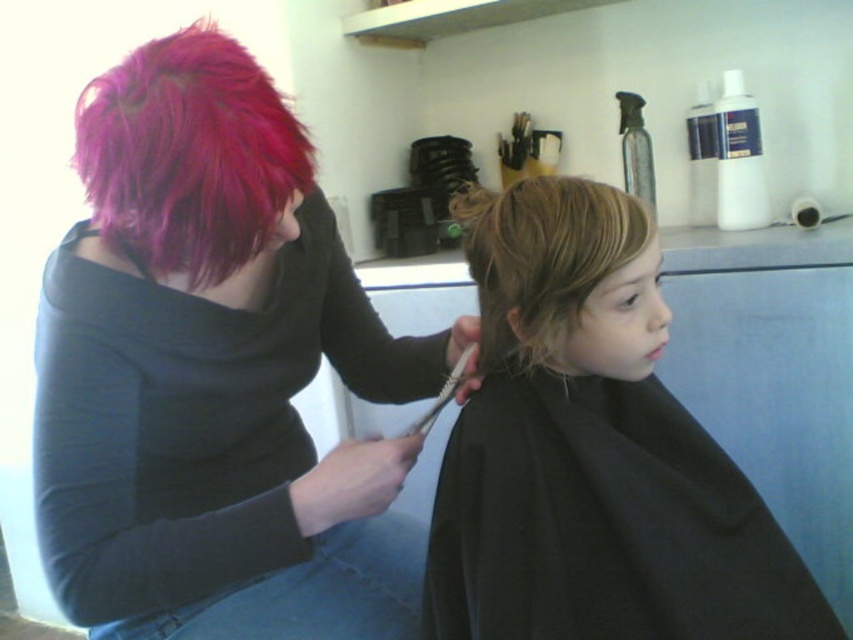
Between shiny pink hair at upper left and blonde hair at center, which one appears on the left side from the viewer's perspective?

From the viewer's perspective, shiny pink hair at upper left appears more on the left side.

Who is more distant from viewer, [108,240] or [434,525]?

Positioned behind is point [108,240].

The width and height of the screenshot is (853, 640). Identify the location of shiny pink hair at upper left. (213, 372).

Is point (341, 550) positioned after point (538, 257)?

That is True.

Between shiny pink hair at upper left and light brown silky hair at center, which one is positioned lower?

shiny pink hair at upper left is below.

Where is `shiny pink hair at upper left`? shiny pink hair at upper left is located at coordinates (213, 372).

Find the location of a particular element. The height and width of the screenshot is (640, 853). shiny pink hair at upper left is located at coordinates (213, 372).

Does shiny pink hair at upper left appear on the right side of matte plastic comb at center?

Incorrect, shiny pink hair at upper left is not on the right side of matte plastic comb at center.

Which of these two, shiny pink hair at upper left or matte plastic comb at center, stands shorter?

Standing shorter between the two is matte plastic comb at center.

Is point (471, 384) farther from camera compared to point (434, 406)?

No, (471, 384) is in front of (434, 406).

Find the location of a particular element. The image size is (853, 640). shiny pink hair at upper left is located at coordinates (213, 372).